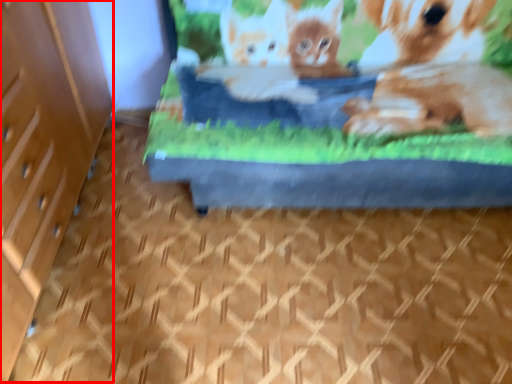
Question: Observing the image, what is the correct spatial positioning of file cabinet (annotated by the red box) in reference to bed?

Choices:
 (A) left
 (B) right

Answer: (A)